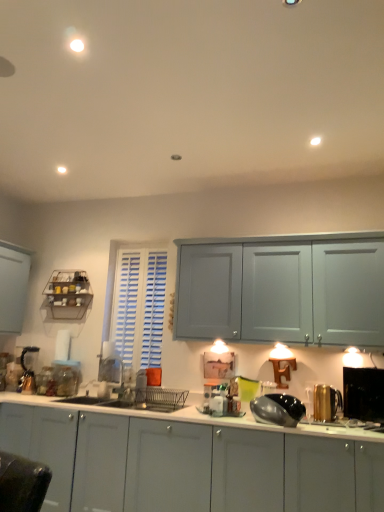
This screenshot has height=512, width=384. What do you see at coordinates (363, 393) in the screenshot?
I see `black glossy toaster at right, arranged as the 1th appliance when viewed from the right` at bounding box center [363, 393].

Measure the distance between white glossy cabinets at lower center and camera.

The depth of white glossy cabinets at lower center is 2.38 meters.

Describe the element at coordinates (190, 464) in the screenshot. I see `white glossy cabinets at lower center` at that location.

Locate an element on the screen. This screenshot has height=512, width=384. gold metallic kettle at right, which ranks as the 2th appliance in right-to-left order is located at coordinates (326, 402).

From the picture: What is the approximate height of metallic silver blender at left, placed as the first appliance when sorted from left to right?

It is 15.77 inches.

I want to click on black glossy toaster at right, positioned as the 2th appliance in front-to-back order, so click(x=363, y=393).

Is gold metallic kettle at right, placed as the third appliance when sorted from front to back, facing towards metallic silver blender at left, which is the fifth appliance in front-to-back order?

No, gold metallic kettle at right, placed as the third appliance when sorted from front to back, is not turned towards metallic silver blender at left, which is the fifth appliance in front-to-back order.

Are gold metallic kettle at right, the 3th appliance when ordered from back to front, and metallic silver blender at left, which is the fifth appliance in front-to-back order, located far from each other?

Yes, gold metallic kettle at right, the 3th appliance when ordered from back to front, is far from metallic silver blender at left, which is the fifth appliance in front-to-back order.

Based on their positions, is gold metallic kettle at right, the 3th appliance when ordered from back to front, located to the left or right of metallic silver blender at left, the first appliance positioned from the back?

Based on their positions, gold metallic kettle at right, the 3th appliance when ordered from back to front, is located to the right of metallic silver blender at left, the first appliance positioned from the back.

Is gold metallic kettle at right, the 3th appliance when ordered from back to front, not within metallic silver blender at left, placed as the first appliance when sorted from left to right?

Yes, gold metallic kettle at right, the 3th appliance when ordered from back to front, is not within metallic silver blender at left, placed as the first appliance when sorted from left to right.

Would you consider metallic wire rack at left to be distant from clear glass jar at lower left, the 4th appliance in the front-to-back sequence?

metallic wire rack at left is near clear glass jar at lower left, the 4th appliance in the front-to-back sequence, not far away.

Does metallic wire rack at left appear on the left side of clear glass jar at lower left, the 4th appliance in the front-to-back sequence?

Indeed, metallic wire rack at left is positioned on the left side of clear glass jar at lower left, the 4th appliance in the front-to-back sequence.

Considering the sizes of objects metallic wire rack at left and clear glass jar at lower left, the 4th appliance in the front-to-back sequence, in the image provided, who is taller, metallic wire rack at left or clear glass jar at lower left, the 4th appliance in the front-to-back sequence,?

With more height is metallic wire rack at left.

Is metallic silver blender at left, the first appliance positioned from the back, completely or partially outside of gold metallic kettle at right, the fourth appliance viewed from the left?

Yes, metallic silver blender at left, the first appliance positioned from the back, is outside of gold metallic kettle at right, the fourth appliance viewed from the left.

Between metallic silver blender at left, placed as the first appliance when sorted from left to right, and gold metallic kettle at right, the fourth appliance viewed from the left, which one appears on the left side from the viewer's perspective?

From the viewer's perspective, metallic silver blender at left, placed as the first appliance when sorted from left to right, appears more on the left side.

Does point (29, 375) appear closer or farther from the camera than point (335, 393)?

Clearly, point (29, 375) is more distant from the camera than point (335, 393).

Can you tell me how much metallic silver blender at left, the 5th appliance from the right, and gold metallic kettle at right, which ranks as the 2th appliance in right-to-left order, differ in facing direction?

6.25 degrees.

From the image's perspective, is metallic wire rack at left under gold metallic kettle at right, the 3th appliance when ordered from back to front?

Incorrect, from the image's perspective, metallic wire rack at left is higher than gold metallic kettle at right, the 3th appliance when ordered from back to front.

Considering their positions, is metallic wire rack at left located in front of or behind gold metallic kettle at right, which ranks as the 2th appliance in right-to-left order?

metallic wire rack at left is behind gold metallic kettle at right, which ranks as the 2th appliance in right-to-left order.

From a real-world perspective, does metallic wire rack at left sit lower than gold metallic kettle at right, the fourth appliance viewed from the left?

No.

Which object is thinner, black glossy toaster at right, arranged as the 1th appliance when viewed from the right, or metallic silver blender at left, placed as the first appliance when sorted from left to right?

Thinner between the two is black glossy toaster at right, arranged as the 1th appliance when viewed from the right.

Which object is positioned more to the right, black glossy toaster at right, which is counted as the fifth appliance, starting from the left, or metallic silver blender at left, the 5th appliance from the right?

Positioned to the right is black glossy toaster at right, which is counted as the fifth appliance, starting from the left.

Is the surface of black glossy toaster at right, which is counted as the fifth appliance, starting from the left, in direct contact with metallic silver blender at left, placed as the first appliance when sorted from left to right?

No, black glossy toaster at right, which is counted as the fifth appliance, starting from the left, is not in contact with metallic silver blender at left, placed as the first appliance when sorted from left to right.

Does black glossy toaster at right, which is counted as the fifth appliance, starting from the left, have a smaller size compared to metallic silver blender at left, which is the fifth appliance in front-to-back order?

Indeed, black glossy toaster at right, which is counted as the fifth appliance, starting from the left, has a smaller size compared to metallic silver blender at left, which is the fifth appliance in front-to-back order.

Consider the image. Is clear glass jar at lower left, which is counted as the 4th appliance, starting from the right, aimed at metallic silver blender at left, the first appliance positioned from the back?

No, clear glass jar at lower left, which is counted as the 4th appliance, starting from the right, is not turned towards metallic silver blender at left, the first appliance positioned from the back.

In the scene shown: Is clear glass jar at lower left, marked as the second appliance in a left-to-right arrangement, positioned far away from metallic silver blender at left, which is the fifth appliance in front-to-back order?

No, clear glass jar at lower left, marked as the second appliance in a left-to-right arrangement, is not far from metallic silver blender at left, which is the fifth appliance in front-to-back order.

From a real-world perspective, is clear glass jar at lower left, marked as the second appliance in a left-to-right arrangement, on top of metallic silver blender at left, placed as the first appliance when sorted from left to right?

No.

From the image's perspective, would you say clear glass jar at lower left, the 4th appliance in the front-to-back sequence, is shown under metallic silver blender at left, which is the fifth appliance in front-to-back order?

Yes, from the image's perspective, clear glass jar at lower left, the 4th appliance in the front-to-back sequence, is below metallic silver blender at left, which is the fifth appliance in front-to-back order.

Is point (30, 385) farther from viewer compared to point (73, 365)?

That is False.

Can you tell me how much metallic silver blender at left, the 5th appliance from the right, and clear glass jar at lower left, the 4th appliance in the front-to-back sequence, differ in facing direction?

The angular difference between metallic silver blender at left, the 5th appliance from the right, and clear glass jar at lower left, the 4th appliance in the front-to-back sequence, is 9.23 degrees.

From the image's perspective, does metallic silver blender at left, which is the fifth appliance in front-to-back order, appear higher than clear glass jar at lower left, the second appliance viewed from the back?

Indeed, from the image's perspective, metallic silver blender at left, which is the fifth appliance in front-to-back order, is shown above clear glass jar at lower left, the second appliance viewed from the back.

Would you say metallic silver blender at left, the first appliance positioned from the back, is to the left or to the right of clear glass jar at lower left, the second appliance viewed from the back, in the picture?

Clearly, metallic silver blender at left, the first appliance positioned from the back, is on the left of clear glass jar at lower left, the second appliance viewed from the back, in the image.

This screenshot has width=384, height=512. In order to click on the 2nd appliance located above the gold metallic kettle at right, the 3th appliance when ordered from back to front (from a real-world perspective) in this screenshot , I will do `click(27, 373)`.

I want to click on shelf behind the clear glass jar at lower left, the 4th appliance in the front-to-back sequence, so click(x=67, y=294).

Based on their spatial positions, is clear glass jar at lower left, which is counted as the 4th appliance, starting from the right, or metallic wire rack at left closer to white glossy cabinets at lower center?

The object closer to white glossy cabinets at lower center is clear glass jar at lower left, which is counted as the 4th appliance, starting from the right.

In the scene shown: When comparing their distances from shiny metallic kettle at center, marked as the fifth appliance in a back-to-front arrangement, does clear glass jar at lower left, the second appliance viewed from the back, or gold metallic kettle at right, the 3th appliance when ordered from back to front, seem further?

clear glass jar at lower left, the second appliance viewed from the back, is positioned further to the anchor shiny metallic kettle at center, marked as the fifth appliance in a back-to-front arrangement.

From the image, which object appears to be nearer to clear glass jar at lower left, which is counted as the 4th appliance, starting from the right, black glossy toaster at right, positioned as the 2th appliance in front-to-back order, or metallic wire rack at left?

The object closer to clear glass jar at lower left, which is counted as the 4th appliance, starting from the right, is metallic wire rack at left.

Which object lies further to the anchor point shiny metallic kettle at center, the 3th appliance in the left-to-right sequence, black glossy toaster at right, which is counted as the fifth appliance, starting from the left, or metallic wire rack at left?

metallic wire rack at left.

Based on their spatial positions, is clear glass jar at lower left, the 4th appliance in the front-to-back sequence, or white glossy cabinets at lower center closer to metallic wire rack at left?

clear glass jar at lower left, the 4th appliance in the front-to-back sequence, lies closer to metallic wire rack at left than the other object.

Considering their positions, is shiny metallic kettle at center, marked as the fifth appliance in a back-to-front arrangement, positioned further to clear glass jar at lower left, which is counted as the 4th appliance, starting from the right, than metallic wire rack at left?

Among the two, shiny metallic kettle at center, marked as the fifth appliance in a back-to-front arrangement, is located further to clear glass jar at lower left, which is counted as the 4th appliance, starting from the right.

Estimate the real-world distances between objects in this image. Which object is closer to white glossy cabinets at lower center, clear glass jar at lower left, the second appliance viewed from the back, or metallic silver blender at left, the first appliance positioned from the back?

The object closer to white glossy cabinets at lower center is clear glass jar at lower left, the second appliance viewed from the back.

Based on their spatial positions, is clear glass jar at lower left, marked as the second appliance in a left-to-right arrangement, or metallic wire rack at left closer to metallic silver blender at left, placed as the first appliance when sorted from left to right?

clear glass jar at lower left, marked as the second appliance in a left-to-right arrangement, is positioned closer to the anchor metallic silver blender at left, placed as the first appliance when sorted from left to right.

Locate an element on the screen. shelf between metallic silver blender at left, placed as the first appliance when sorted from left to right, and shiny metallic kettle at center, the 3th appliance in the right-to-left sequence, from left to right is located at coordinates (67, 294).

The height and width of the screenshot is (512, 384). What are the coordinates of `cabinetry located between clear glass jar at lower left, marked as the second appliance in a left-to-right arrangement, and gold metallic kettle at right, the 3th appliance when ordered from back to front, in the left-right direction` in the screenshot? It's located at (190, 464).

Where is `appliance between shiny metallic kettle at center, the 3th appliance in the left-to-right sequence, and black glossy toaster at right, positioned as the 2th appliance in front-to-back order, in the horizontal direction`? This screenshot has width=384, height=512. appliance between shiny metallic kettle at center, the 3th appliance in the left-to-right sequence, and black glossy toaster at right, positioned as the 2th appliance in front-to-back order, in the horizontal direction is located at coordinates pos(326,402).

Identify the location of cabinetry between clear glass jar at lower left, the 4th appliance in the front-to-back sequence, and shiny metallic kettle at center, marked as the fifth appliance in a back-to-front arrangement, in the horizontal direction. The width and height of the screenshot is (384, 512). (190, 464).